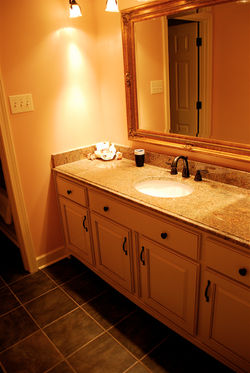
Where is `faucet`? This screenshot has width=250, height=373. faucet is located at coordinates (173, 167).